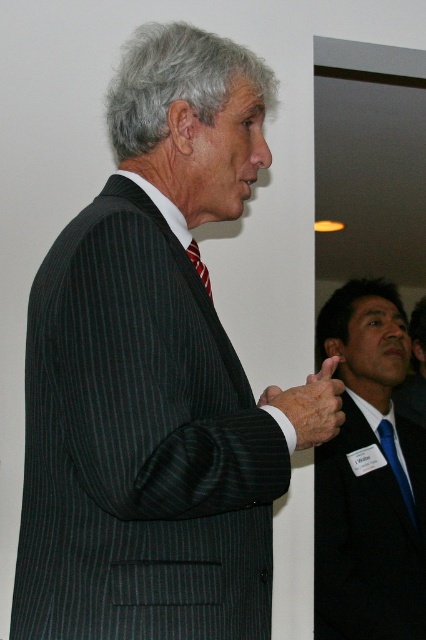
Question: Is matte black hand at center closer to the viewer compared to blue silk tie at right?

Choices:
 (A) no
 (B) yes

Answer: (B)

Question: Can you confirm if matte black suit at center is positioned to the left of blue silk tie at right?

Choices:
 (A) yes
 (B) no

Answer: (A)

Question: Which object is positioned closest to the matte black suit at center?

Choices:
 (A) matte black hand at center
 (B) red striped tie at center

Answer: (A)

Question: Which object appears closest to the camera in this image?

Choices:
 (A) matte black hand at center
 (B) red striped tie at center
 (C) blue silk tie at right

Answer: (A)

Question: Does matte black suit at center have a larger size compared to red striped tie at center?

Choices:
 (A) no
 (B) yes

Answer: (B)

Question: Which point is closer to the camera?

Choices:
 (A) (201, 260)
 (B) (321, 400)
 (C) (416, 529)

Answer: (B)